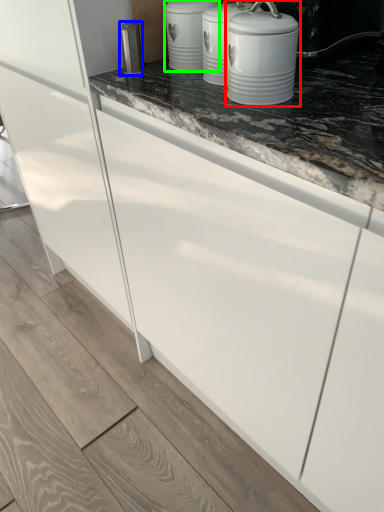
Question: Which object is positioned closest to home appliance (highlighted by a red box)? Select from appliance (highlighted by a blue box) and kitchen appliance (highlighted by a green box).

Choices:
 (A) appliance
 (B) kitchen appliance

Answer: (B)